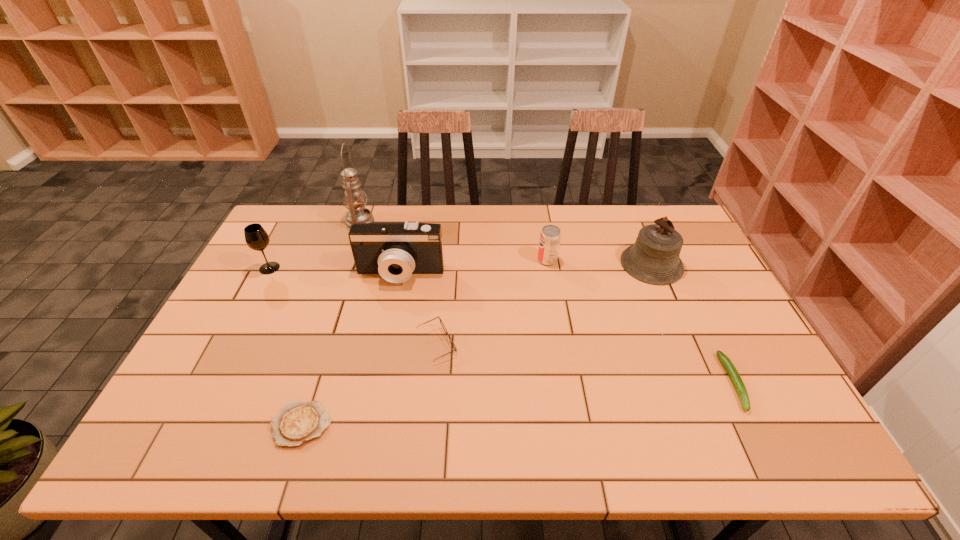
Identify the location of free location located on the front of the tallest object. This screenshot has width=960, height=540. (352, 242).

The height and width of the screenshot is (540, 960). Find the location of `free space located on the front of the bell`. free space located on the front of the bell is located at coordinates (685, 343).

Identify the location of blank space located 0.200m on the lens of the camcorder. This screenshot has width=960, height=540. (388, 339).

Where is `vacant area located 0.270m on the front of the wineglass`? The image size is (960, 540). vacant area located 0.270m on the front of the wineglass is located at coordinates (230, 343).

This screenshot has width=960, height=540. In order to click on vacant space located on the front of the third object from right to left in this screenshot , I will do `click(553, 295)`.

This screenshot has width=960, height=540. I want to click on vacant space located 0.240m with the lenses facing outward on the spectacles, so click(x=547, y=345).

This screenshot has width=960, height=540. I want to click on free space located 0.060m on the front-facing side of the seventh tallest object, so click(760, 438).

Where is `vacant space located 0.360m on the back of the shortest object`? The height and width of the screenshot is (540, 960). vacant space located 0.360m on the back of the shortest object is located at coordinates (343, 294).

Locate an element on the screen. This screenshot has height=540, width=960. oil lamp situated at the far edge is located at coordinates [x=354, y=197].

Locate an element on the screen. bell situated at the far edge is located at coordinates (654, 258).